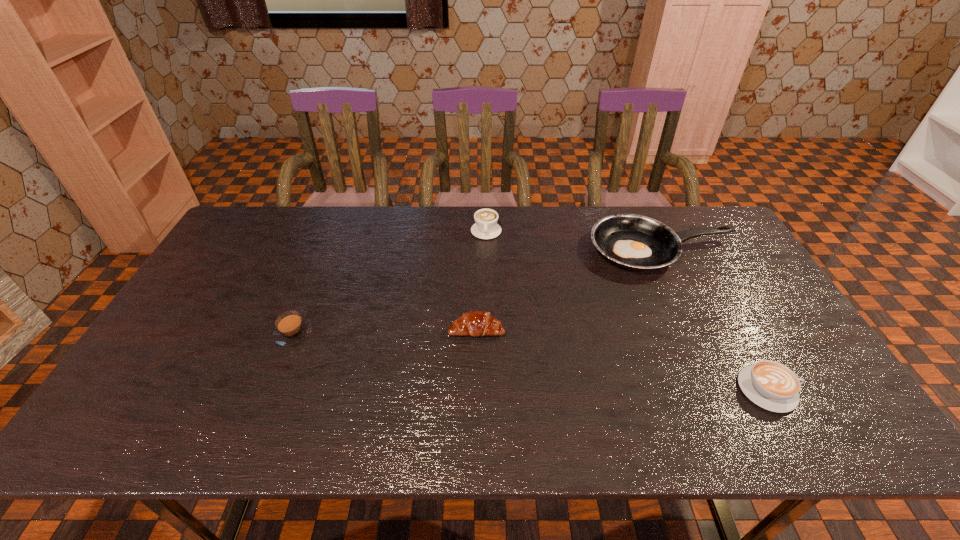
The width and height of the screenshot is (960, 540). What are the coordinates of `the tallest cappuccino` in the screenshot? It's located at (485, 227).

Find the location of a particular element. The height and width of the screenshot is (540, 960). the tallest object is located at coordinates (485, 227).

This screenshot has width=960, height=540. I want to click on frying pan, so click(635, 242).

Where is `the leftmost object`? Image resolution: width=960 pixels, height=540 pixels. the leftmost object is located at coordinates (291, 329).

Identify the location of the leftmost cappuccino. (291, 329).

At what (x,y) coordinates should I click in order to perform the action: click on crescent roll. Please return your answer as a coordinate pair (x, y). Looking at the image, I should click on (476, 323).

Where is `the nearest object`? The image size is (960, 540). the nearest object is located at coordinates (771, 385).

Locate an element on the screen. the nearest cappuccino is located at coordinates (771, 385).

You are a GUI agent. You are given a task and a screenshot of the screen. Output one action in this format:
    pyautogui.click(x=<x>, y=<y>)
    Task: Click on the vacant space situated 0.360m to the right of the tallest object's handle
    
    Given the screenshot: What is the action you would take?
    pyautogui.click(x=488, y=322)

This screenshot has height=540, width=960. I want to click on vacant space situated 0.360m on the front of the frying pan, so click(724, 381).